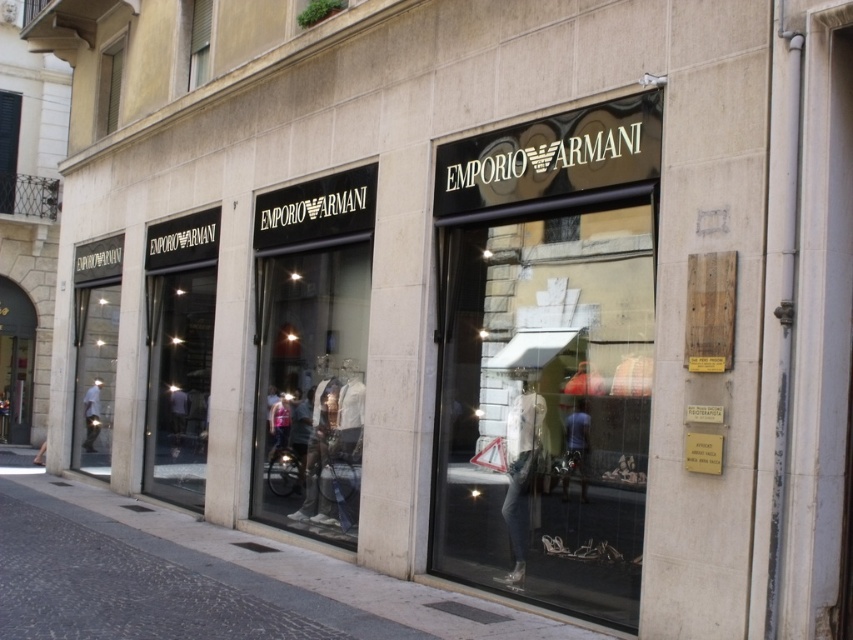
Is transparent glass at center to the right of matte black mannequin at center from the viewer's perspective?

Incorrect, transparent glass at center is not on the right side of matte black mannequin at center.

Is point (604, 328) less distant than point (572, 410)?

That is True.

At what (x,y) coordinates should I click in order to perform the action: click on transparent glass at center. Please return your answer as a coordinate pair (x, y). This screenshot has height=640, width=853. Looking at the image, I should click on (544, 403).

Is matte black mannequin at center above white matte mannequin at left?

Yes.

Does point (589, 422) come farther from viewer compared to point (86, 408)?

No, it is not.

Locate an element on the screen. matte black mannequin at center is located at coordinates (575, 449).

This screenshot has height=640, width=853. I want to click on transparent glass at center, so click(x=544, y=403).

The height and width of the screenshot is (640, 853). Find the location of `transparent glass at center`. transparent glass at center is located at coordinates (544, 403).